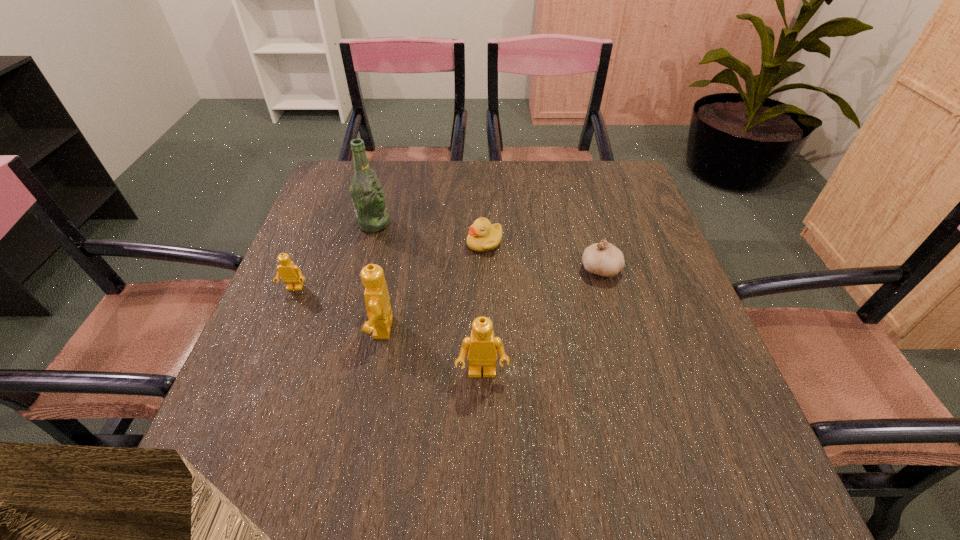
This screenshot has height=540, width=960. What are the coordinates of `the leftmost Lego` in the screenshot? It's located at (290, 273).

I want to click on the shortest Lego, so coord(290,273).

I want to click on the third object from left to right, so click(x=377, y=300).

What are the coordinates of `the second Lego from right to left` in the screenshot? It's located at (377, 300).

The width and height of the screenshot is (960, 540). I want to click on the nearest Lego, so click(x=481, y=347).

Find the location of `the third tallest object`. the third tallest object is located at coordinates (481, 347).

Identify the location of the rightmost object. The width and height of the screenshot is (960, 540). (604, 259).

Where is `the shortest object`? the shortest object is located at coordinates (482, 237).

Locate an element on the screen. beer bottle is located at coordinates (366, 190).

The width and height of the screenshot is (960, 540). Identify the location of the second object from left to right. (366, 190).